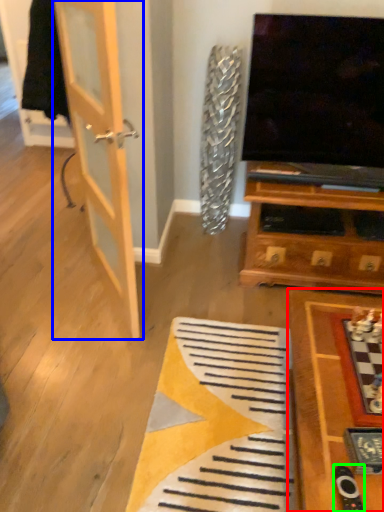
Question: Which object is positioned closest to table (highlighted by a red box)? Select from door (highlighted by a blue box) and remote (highlighted by a green box).

Choices:
 (A) door
 (B) remote

Answer: (B)